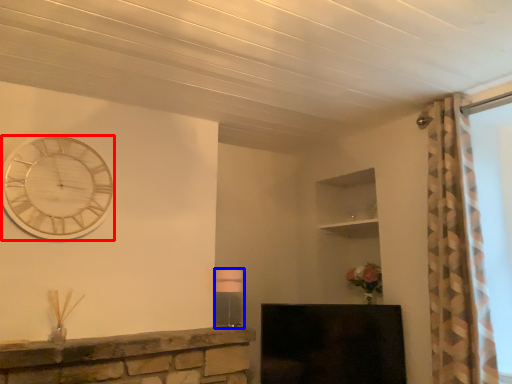
Question: Among these objects, which one is nearest to the camera, wall clock (highlighted by a red box) or lamp (highlighted by a blue box)?

Choices:
 (A) wall clock
 (B) lamp

Answer: (A)